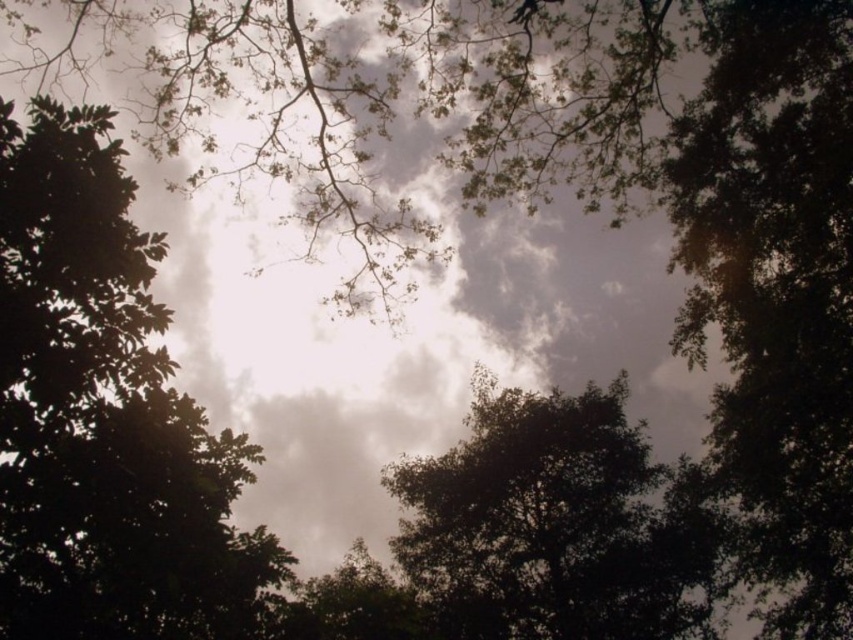
Based on the photo, does green leafy tree at upper center have a greater width compared to dark green leafy tree at center?

Yes, green leafy tree at upper center is wider than dark green leafy tree at center.

How far apart are green leafy tree at upper center and dark green leafy tree at center?

green leafy tree at upper center and dark green leafy tree at center are 52.56 feet apart.

Which is in front, point (30, 378) or point (611, 506)?

Positioned in front is point (30, 378).

Identify the location of green leafy tree at upper center. This screenshot has height=640, width=853. (105, 417).